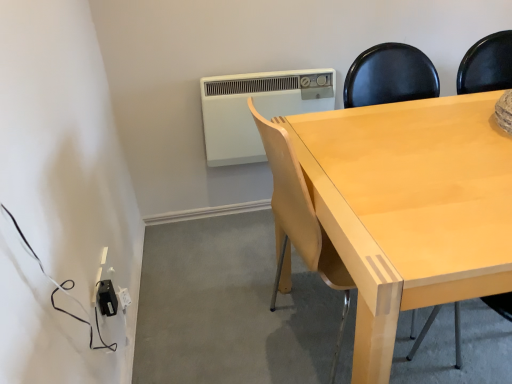
You are a GUI agent. You are given a task and a screenshot of the screen. Output one action in this format:
    pyautogui.click(x=<x>, y=<y>)
    Task: Click on the white plastic air conditioner at upper center
    The image size is (512, 384).
    Given the screenshot: What is the action you would take?
    pyautogui.click(x=257, y=108)

The width and height of the screenshot is (512, 384). What do you see at coordinates (257, 108) in the screenshot?
I see `white plastic air conditioner at upper center` at bounding box center [257, 108].

What do you see at coordinates (300, 220) in the screenshot?
I see `light wood chair at center` at bounding box center [300, 220].

The image size is (512, 384). Identify the location of black plastic outlet at lower left. (106, 298).

From a real-world perspective, is light wood chair at center physically below black plastic outlet at lower left?

No.

Which object is positioned more to the right, light wood chair at center or black plastic outlet at lower left?

From the viewer's perspective, light wood chair at center appears more on the right side.

Is black plastic outlet at lower left a part of light wood chair at center?

Actually, black plastic outlet at lower left is outside light wood chair at center.

Locate an element on the screen. This screenshot has width=512, height=384. chair above the black plastic outlet at lower left (from a real-world perspective) is located at coordinates click(300, 220).

From a real-world perspective, is white plastic air conditioner at upper center positioned under light wood chair at center based on gravity?

No, from a real-world perspective, white plastic air conditioner at upper center is not below light wood chair at center.

From the picture: Considering the sizes of white plastic air conditioner at upper center and light wood chair at center in the image, is white plastic air conditioner at upper center taller or shorter than light wood chair at center?

Considering their sizes, white plastic air conditioner at upper center has less height than light wood chair at center.

From the picture: Which object is wider, white plastic air conditioner at upper center or light wood chair at center?

Wider between the two is light wood chair at center.

Is white plastic air conditioner at upper center touching light wood chair at center?

white plastic air conditioner at upper center is not next to light wood chair at center, and they're not touching.

I want to click on air conditioning above the black plastic outlet at lower left (from the image's perspective), so click(257, 108).

From a real-world perspective, is white plastic air conditioner at upper center below black plastic outlet at lower left?

No.

What's the angular difference between white plastic air conditioner at upper center and black plastic outlet at lower left's facing directions?

87 degrees separate the facing orientations of white plastic air conditioner at upper center and black plastic outlet at lower left.

Which object is positioned more to the right, white plastic air conditioner at upper center or black plastic outlet at lower left?

white plastic air conditioner at upper center is more to the right.

From a real-world perspective, relative to white plastic air conditioner at upper center, is light wood chair at center vertically above or below?

light wood chair at center is situated lower than white plastic air conditioner at upper center in the real world.

Looking at their sizes, would you say light wood chair at center is wider or thinner than white plastic air conditioner at upper center?

light wood chair at center is wider than white plastic air conditioner at upper center.

Does light wood chair at center have a lesser height compared to white plastic air conditioner at upper center?

No, light wood chair at center is not shorter than white plastic air conditioner at upper center.

From the image's perspective, which is below, light wood chair at center or white plastic air conditioner at upper center?

light wood chair at center is shown below in the image.

Choose the correct answer: Is black plastic outlet at lower left inside light wood chair at center or outside it?

The correct answer is: outside.

Could you tell me if black plastic outlet at lower left is turned towards light wood chair at center?

Yes, black plastic outlet at lower left is oriented towards light wood chair at center.

Is black plastic outlet at lower left not close to light wood chair at center?

No, black plastic outlet at lower left is not far from light wood chair at center.

Can you tell me how much black plastic outlet at lower left and light wood chair at center differ in facing direction?

There is a 4.41-degree angle between the facing directions of black plastic outlet at lower left and light wood chair at center.

From the picture: Is white plastic air conditioner at upper center inside black plastic outlet at lower left?

No, white plastic air conditioner at upper center is located outside of black plastic outlet at lower left.

From the image's perspective, which one is positioned higher, black plastic outlet at lower left or white plastic air conditioner at upper center?

From the image's view, white plastic air conditioner at upper center is above.

Is black plastic outlet at lower left oriented towards white plastic air conditioner at upper center?

No, black plastic outlet at lower left is not aimed at white plastic air conditioner at upper center.

Locate an element on the screen. Image resolution: width=512 pixels, height=384 pixels. chair above the black plastic outlet at lower left (from the image's perspective) is located at coordinates (300, 220).

Image resolution: width=512 pixels, height=384 pixels. Find the location of `chair below the white plastic air conditioner at upper center (from a real-world perspective)`. chair below the white plastic air conditioner at upper center (from a real-world perspective) is located at coordinates (300, 220).

Looking at the image, which one is located closer to white plastic air conditioner at upper center, light wood chair at center or black plastic outlet at lower left?

light wood chair at center is positioned closer to the anchor white plastic air conditioner at upper center.

From the image, which object appears to be farther from light wood chair at center, white plastic air conditioner at upper center or black plastic outlet at lower left?

Based on the image, white plastic air conditioner at upper center appears to be further to light wood chair at center.

In the scene shown: Looking at the image, which one is located further to white plastic air conditioner at upper center, black plastic outlet at lower left or light wood chair at center?

The object further to white plastic air conditioner at upper center is black plastic outlet at lower left.

When comparing their distances from light wood chair at center, does black plastic outlet at lower left or white plastic air conditioner at upper center seem closer?

black plastic outlet at lower left lies closer to light wood chair at center than the other object.

Looking at this image, estimate the real-world distances between objects in this image. Which object is closer to black plastic outlet at lower left, white plastic air conditioner at upper center or light wood chair at center?

light wood chair at center.

Estimate the real-world distances between objects in this image. Which object is further from black plastic outlet at lower left, light wood chair at center or white plastic air conditioner at upper center?

Based on the image, white plastic air conditioner at upper center appears to be further to black plastic outlet at lower left.

Where is `electric outlet located between light wood chair at center and white plastic air conditioner at upper center in the depth direction`? This screenshot has width=512, height=384. electric outlet located between light wood chair at center and white plastic air conditioner at upper center in the depth direction is located at coordinates (106, 298).